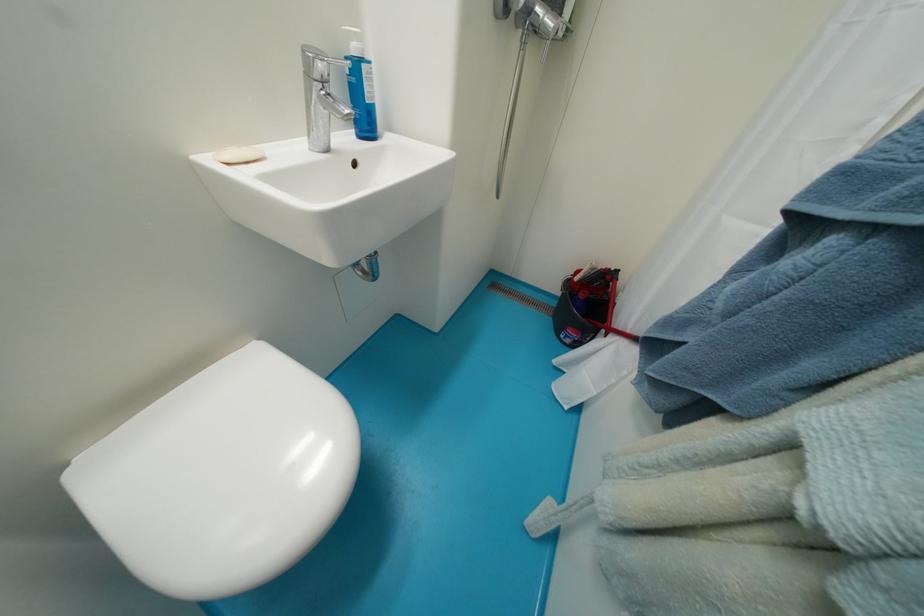
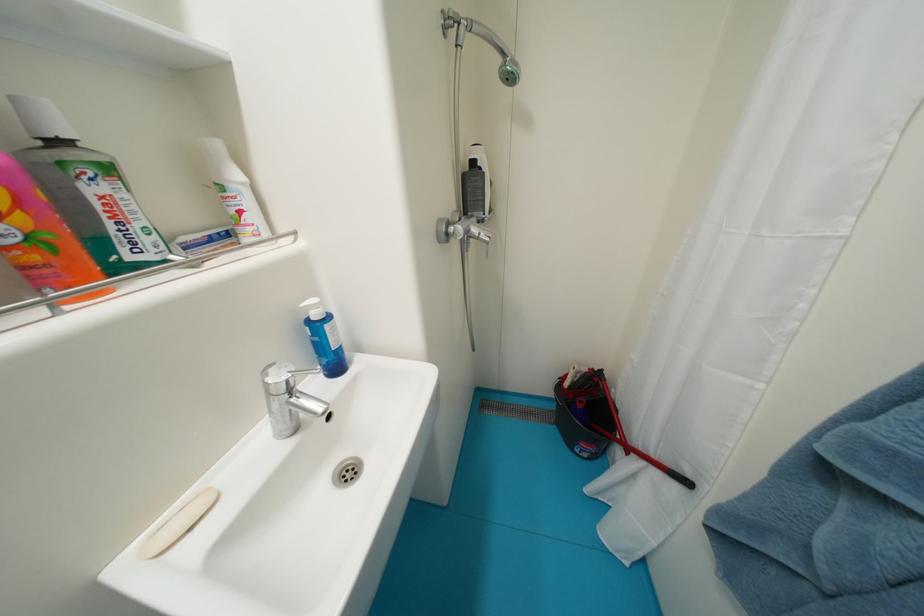
Question: The first image is from the beginning of the video and the second image is from the end. How did the camera likely rotate when shooting the video?

Choices:
 (A) Left
 (B) Right
 (C) Up
 (D) Down

Answer: (C)